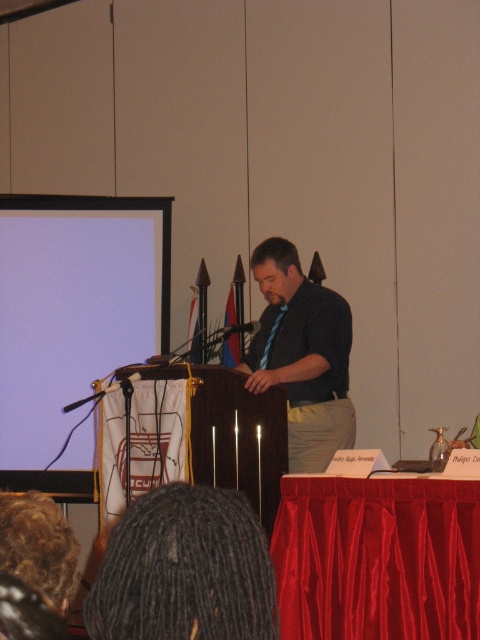
Between dark dreadlocks at lower center and dark blue shirt at center, which one appears on the left side from the viewer's perspective?

Positioned to the left is dark dreadlocks at lower center.

Can you confirm if dark dreadlocks at lower center is shorter than dark blue shirt at center?

Indeed, dark dreadlocks at lower center has a lesser height compared to dark blue shirt at center.

Identify the location of dark dreadlocks at lower center. (184, 570).

Locate an element on the screen. The width and height of the screenshot is (480, 640). dark dreadlocks at lower center is located at coordinates (184, 570).

Can you confirm if white matte projection screen at upper left is positioned above dark blue shirt at center?

Indeed, white matte projection screen at upper left is positioned over dark blue shirt at center.

The image size is (480, 640). What are the coordinates of `white matte projection screen at upper left` in the screenshot? It's located at (73, 307).

Image resolution: width=480 pixels, height=640 pixels. What do you see at coordinates (73, 307) in the screenshot?
I see `white matte projection screen at upper left` at bounding box center [73, 307].

Between point (155, 321) and point (176, 493), which one is positioned in front?

Point (176, 493)

Between point (127, 328) and point (189, 608), which one is positioned behind?

Positioned behind is point (127, 328).

Where is `white matte projection screen at upper left`? This screenshot has height=640, width=480. white matte projection screen at upper left is located at coordinates (73, 307).